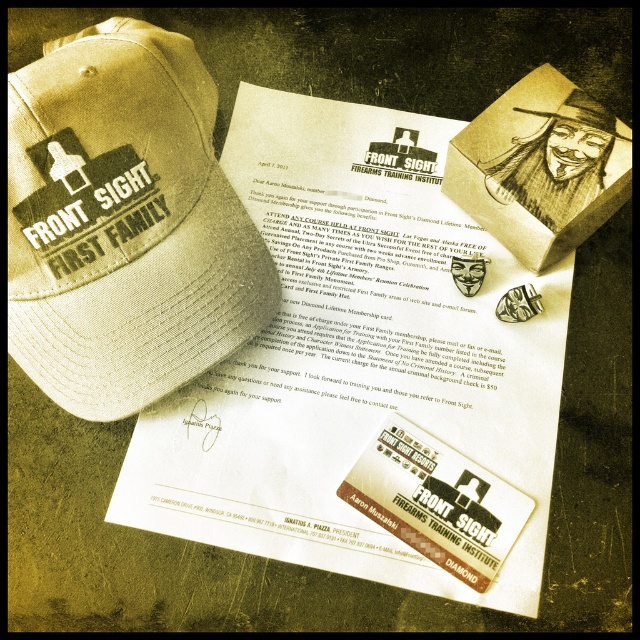
You are organizing items on a desk and see the tan fabric baseball cap at upper left and the matte khaki baseball cap at upper left. Which one is closer to you?

The tan fabric baseball cap at upper left is closer to you because it is in front of the matte khaki baseball cap at upper left.

Where is the white paper at center located in the image?

The white paper at center is located at the 2D coordinates point (364,364).